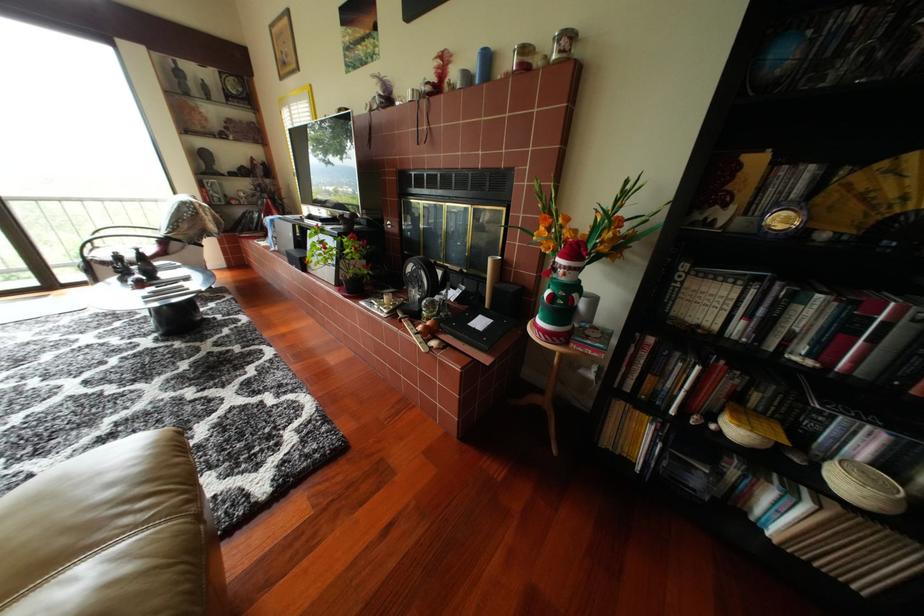
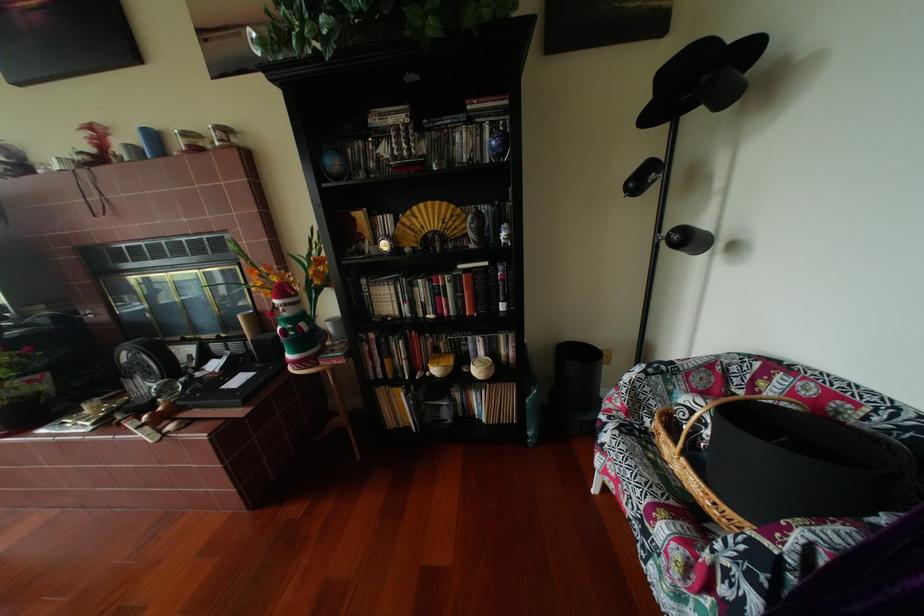
The point at [784,484] is marked in the first image. Where is the corresponding point in the second image?

(484, 391)